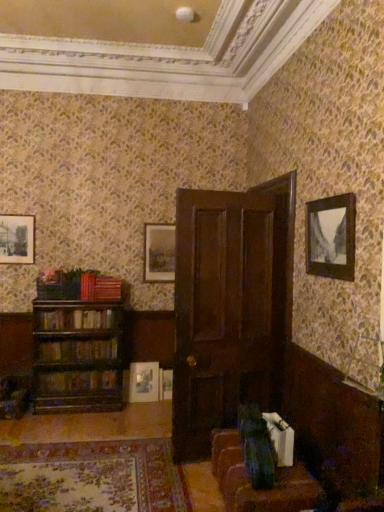
Identify the location of vacant area situated below wooden bookshelf at left, placed as the 3th book when sorted from top to bottom (from a real-world perspective). The image size is (384, 512). (87, 369).